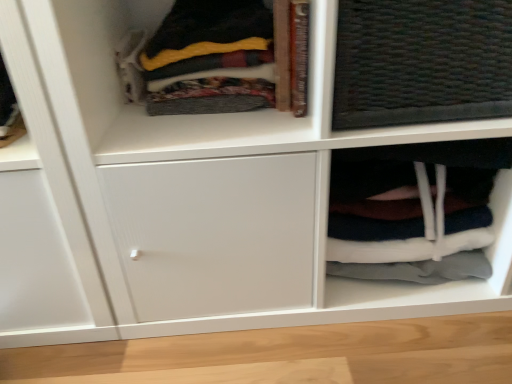
Measure the distance between soft fleece blanket at upper left and camera.

The distance of soft fleece blanket at upper left from camera is 68.17 centimeters.

Image resolution: width=512 pixels, height=384 pixels. Describe the element at coordinates (209, 38) in the screenshot. I see `soft fleece blanket at upper left` at that location.

Locate an element on the screen. The image size is (512, 384). soft fleece blanket at upper left is located at coordinates tap(209, 38).

What do you see at coordinates (404, 199) in the screenshot?
I see `white fabric at lower right` at bounding box center [404, 199].

The width and height of the screenshot is (512, 384). Identify the location of white fabric at lower right. (x=404, y=199).

Measure the distance between white fabric at lower right and camera.

A distance of 27.60 inches exists between white fabric at lower right and camera.

Locate an element on the screen. This screenshot has width=512, height=384. soft fleece blanket at upper left is located at coordinates (209, 38).

Can you confirm if white fabric at lower right is positioned to the right of soft fleece blanket at upper left?

Yes.

Considering the relative positions of white fabric at lower right and soft fleece blanket at upper left in the image provided, is white fabric at lower right behind soft fleece blanket at upper left?

Yes, the depth of white fabric at lower right is greater than that of soft fleece blanket at upper left.

Is point (380, 228) closer to camera compared to point (213, 17)?

No, (380, 228) is behind (213, 17).

From the picture: From the image's perspective, who appears lower, white fabric at lower right or soft fleece blanket at upper left?

white fabric at lower right, from the image's perspective.

Based on the photo, from a real-world perspective, is white fabric at lower right over soft fleece blanket at upper left?

No, from a real-world perspective, white fabric at lower right is not over soft fleece blanket at upper left

Looking at their sizes, would you say white fabric at lower right is wider or thinner than soft fleece blanket at upper left?

white fabric at lower right is thinner than soft fleece blanket at upper left.

Based on the photo, can you confirm if white fabric at lower right is shorter than soft fleece blanket at upper left?

In fact, white fabric at lower right may be taller than soft fleece blanket at upper left.

Consider the image. In terms of size, does white fabric at lower right appear bigger or smaller than soft fleece blanket at upper left?

In the image, white fabric at lower right appears to be larger than soft fleece blanket at upper left.

Would you say white fabric at lower right is outside soft fleece blanket at upper left?

white fabric at lower right lies outside soft fleece blanket at upper left's area.

Looking at this image, are white fabric at lower right and soft fleece blanket at upper left far apart?

No, there isn't a large distance between white fabric at lower right and soft fleece blanket at upper left.

Is white fabric at lower right facing towards soft fleece blanket at upper left?

No, white fabric at lower right is not oriented towards soft fleece blanket at upper left.

You are a GUI agent. You are given a task and a screenshot of the screen. Output one action in this format:
    pyautogui.click(x=<x>, y=<y>)
    Task: Click on the cabinet located below the soft fleece blanket at upper left (from the image's perspective)
    The height and width of the screenshot is (384, 512).
    Given the screenshot: What is the action you would take?
    pyautogui.click(x=404, y=199)

In the image, is soft fleece blanket at upper left on the left side or the right side of white fabric at lower right?

Clearly, soft fleece blanket at upper left is on the left of white fabric at lower right in the image.

Based on the photo, considering the relative positions of soft fleece blanket at upper left and white fabric at lower right in the image provided, is soft fleece blanket at upper left in front of white fabric at lower right?

Yes, it is.

Is point (183, 68) farther from camera compared to point (501, 167)?

That is False.

From the image's perspective, is soft fleece blanket at upper left positioned above or below white fabric at lower right?

From the image's perspective, soft fleece blanket at upper left appears above white fabric at lower right.

From a real-world perspective, who is located higher, soft fleece blanket at upper left or white fabric at lower right?

soft fleece blanket at upper left is physically above.

Considering the relative sizes of soft fleece blanket at upper left and white fabric at lower right in the image provided, is soft fleece blanket at upper left thinner than white fabric at lower right?

In fact, soft fleece blanket at upper left might be wider than white fabric at lower right.

Is soft fleece blanket at upper left taller or shorter than white fabric at lower right?

Clearly, soft fleece blanket at upper left is shorter compared to white fabric at lower right.

Which of these two, soft fleece blanket at upper left or white fabric at lower right, is bigger?

With larger size is white fabric at lower right.

Is soft fleece blanket at upper left not inside white fabric at lower right?

Yes, soft fleece blanket at upper left is not within white fabric at lower right.

Would you say soft fleece blanket at upper left is a long distance from white fabric at lower right?

No, soft fleece blanket at upper left is in close proximity to white fabric at lower right.

Is soft fleece blanket at upper left aimed at white fabric at lower right?

No, soft fleece blanket at upper left does not turn towards white fabric at lower right.

Image resolution: width=512 pixels, height=384 pixels. In order to click on clothing above the white fabric at lower right (from a real-world perspective) in this screenshot , I will do click(x=209, y=38).

The image size is (512, 384). There is a white fabric at lower right. In order to click on clothing above it (from a real-world perspective) in this screenshot , I will do `click(209, 38)`.

You are a GUI agent. You are given a task and a screenshot of the screen. Output one action in this format:
    pyautogui.click(x=<x>, y=<y>)
    Task: Click on the clothing located on the left of white fabric at lower right
    
    Given the screenshot: What is the action you would take?
    pyautogui.click(x=209, y=38)